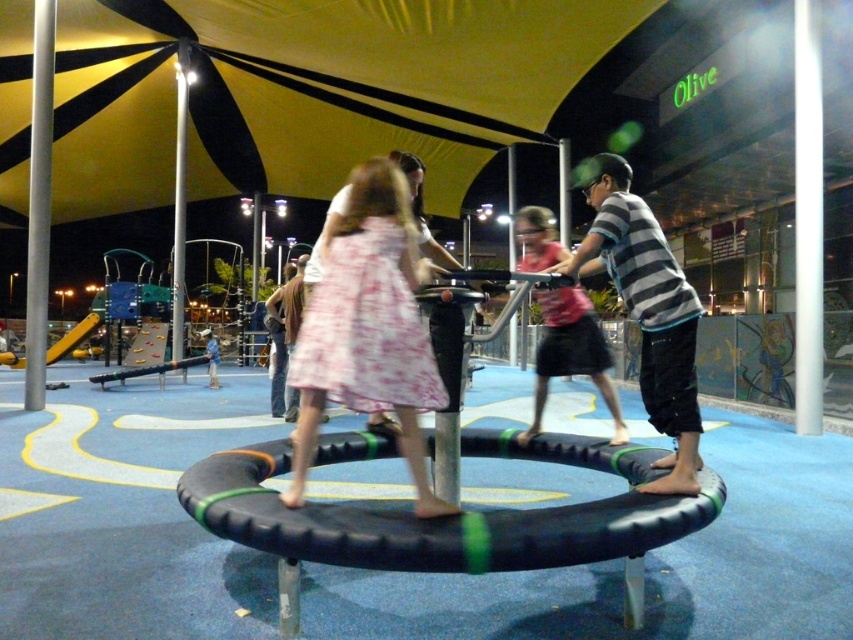
Question: Among these objects, which one is nearest to the camera?

Choices:
 (A) black rubber tire at center
 (B) floral dress at center
 (C) striped cotton shirt at center

Answer: (A)

Question: Which point is closer to the camera?

Choices:
 (A) pink fabric dress at center
 (B) striped cotton shirt at center
 (C) black rubber tire at center

Answer: (C)

Question: Is black rubber tire at center further to the viewer compared to striped cotton shirt at center?

Choices:
 (A) no
 (B) yes

Answer: (A)

Question: Estimate the real-world distances between objects in this image. Which object is farther from the pink fabric dress at center?

Choices:
 (A) black rubber tire at center
 (B) floral dress at center

Answer: (A)

Question: Does black rubber tire at center have a greater width compared to floral dress at center?

Choices:
 (A) yes
 (B) no

Answer: (A)

Question: Is black rubber tire at center below striped cotton shirt at center?

Choices:
 (A) no
 (B) yes

Answer: (B)